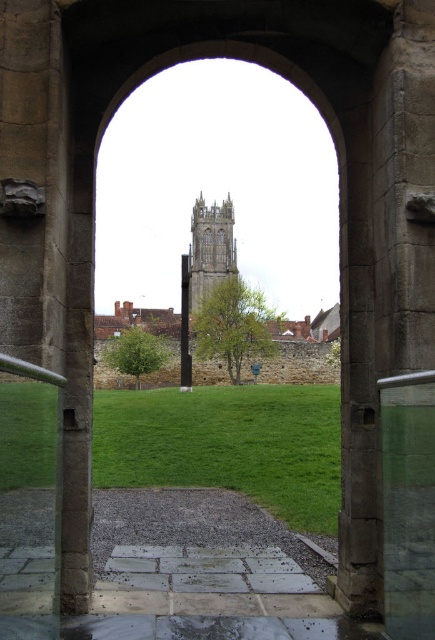
Who is higher up, green grass at center or stone tower at center?

Positioned higher is stone tower at center.

Does green grass at center have a smaller size compared to stone tower at center?

Yes, green grass at center is smaller than stone tower at center.

Measure the distance between point (304,520) and camera.

A distance of 55.16 meters exists between point (304,520) and camera.

Locate an element on the screen. This screenshot has width=435, height=640. green grass at center is located at coordinates (227, 445).

Can you confirm if stone tower at center is thinner than stone gothic tower at center?

No, stone tower at center is not thinner than stone gothic tower at center.

Is stone tower at center wider than stone gothic tower at center?

Correct, the width of stone tower at center exceeds that of stone gothic tower at center.

Who is more distant from viewer, [246,365] or [231,202]?

The point [231,202] is behind.

Image resolution: width=435 pixels, height=640 pixels. Find the location of `stone tower at center`. stone tower at center is located at coordinates (301, 349).

Is point (131, 396) farther from camera compared to point (187, 291)?

That is False.

Does green grass at center have a larger size compared to black stone pillar at center?

Actually, green grass at center might be smaller than black stone pillar at center.

Locate an element on the screen. green grass at center is located at coordinates (227, 445).